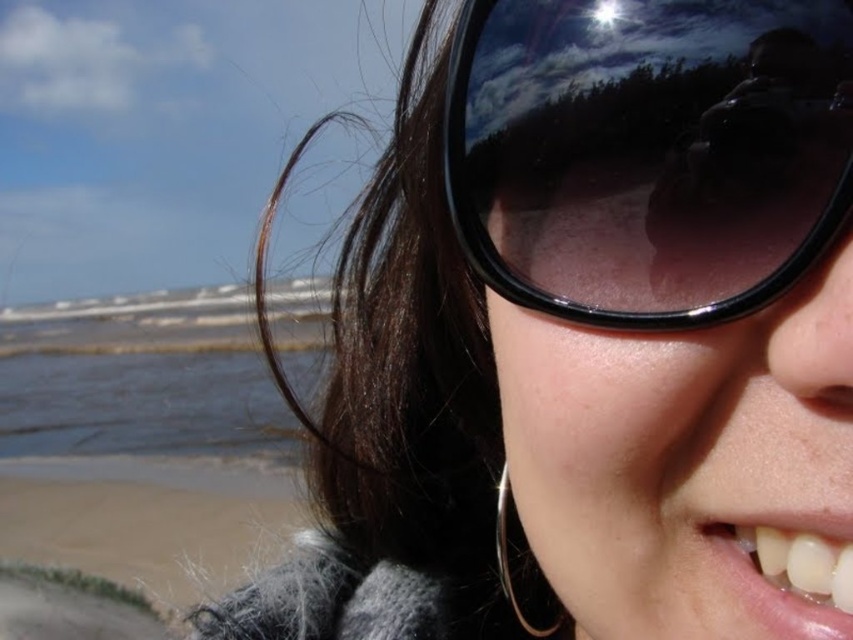
Question: Which of the following is the farthest from the observer?

Choices:
 (A) sandy beach at lower left
 (B) black plastic sunglasses at upper center

Answer: (A)

Question: Does black plastic sunglasses at upper center appear on the left side of sandy beach at lower left?

Choices:
 (A) no
 (B) yes

Answer: (A)

Question: Which point is farther from the camera taking this photo?

Choices:
 (A) coord(602,269)
 (B) coord(86,419)

Answer: (B)

Question: In this image, where is black plastic sunglasses at upper center located relative to sandy beach at lower left?

Choices:
 (A) right
 (B) left

Answer: (A)

Question: Observing the image, what is the correct spatial positioning of black plastic sunglasses at upper center in reference to sandy beach at lower left?

Choices:
 (A) right
 (B) left

Answer: (A)